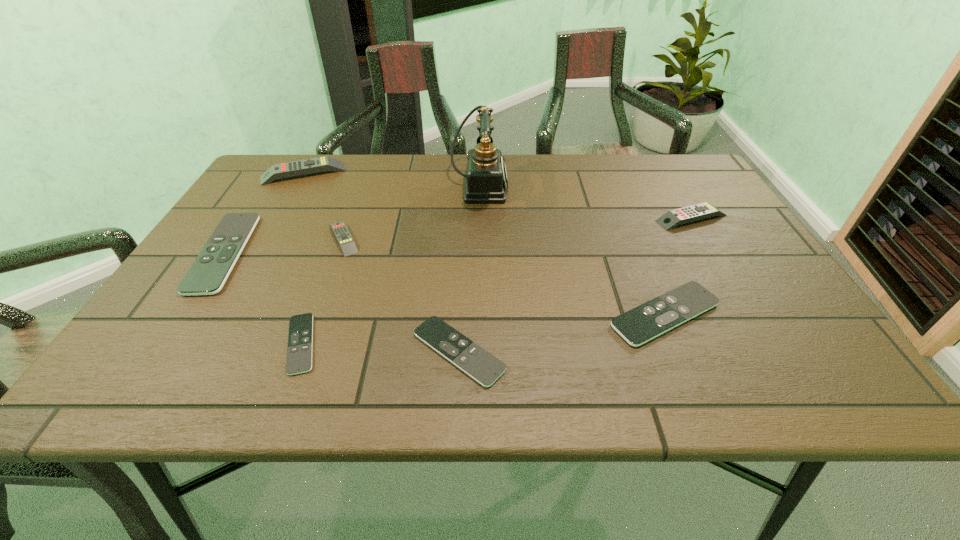
This screenshot has height=540, width=960. Find the location of `free space located 0.110m on the right of the leftmost black remote control`. free space located 0.110m on the right of the leftmost black remote control is located at coordinates (292, 253).

This screenshot has height=540, width=960. Identify the location of free space located 0.140m on the back of the second biggest black remote control. (636, 245).

Locate an element on the screen. The width and height of the screenshot is (960, 540). free region located 0.160m on the right of the second black remote control from right to left is located at coordinates (590, 351).

Find the location of a particular element. The height and width of the screenshot is (540, 960). blank space located on the back of the shortest object is located at coordinates (348, 218).

You are a GUI agent. You are given a task and a screenshot of the screen. Output one action in this format:
    pyautogui.click(x=<x>, y=<y>)
    Task: Click on the telephone located at the far edge
    This screenshot has width=960, height=540.
    Given the screenshot: What is the action you would take?
    pyautogui.click(x=486, y=177)

I want to click on remote control at the far edge, so [308, 166].

Locate an element on the screen. The image size is (960, 540). object positioned at the far left corner is located at coordinates [308, 166].

In the image, there is a desktop. Where is `blank space at the far edge`? blank space at the far edge is located at coordinates (648, 186).

This screenshot has width=960, height=540. Identify the location of vacant space at the near edge. (399, 369).

I want to click on free location at the left edge, so click(262, 251).